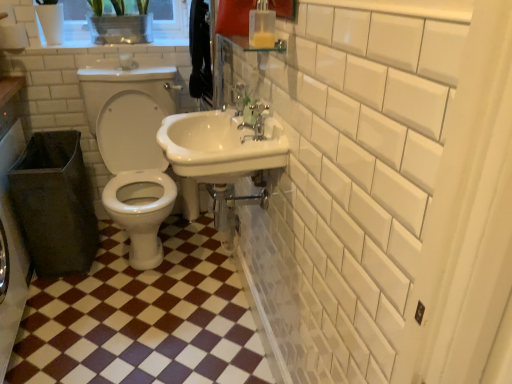
Question: In terms of height, does satin nickel faucet at upper center look taller or shorter compared to clear plastic container at upper left?

Choices:
 (A) tall
 (B) short

Answer: (B)

Question: From the image's perspective, relative to clear plastic container at upper left, is satin nickel faucet at upper center above or below?

Choices:
 (A) below
 (B) above

Answer: (A)

Question: Which object is the farthest from the brown glossy tile at center?

Choices:
 (A) white glossy sink at center
 (B) matte silver faucet at upper center
 (C) white glossy toilet at center
 (D) clear plastic container at upper left
 (E) satin nickel faucet at upper center

Answer: (D)

Question: Which object is the farthest from the white glossy toilet at center?

Choices:
 (A) clear plastic container at upper left
 (B) brown glossy tile at center
 (C) satin nickel faucet at upper center
 (D) white glossy sink at center
 (E) matte silver faucet at upper center

Answer: (E)